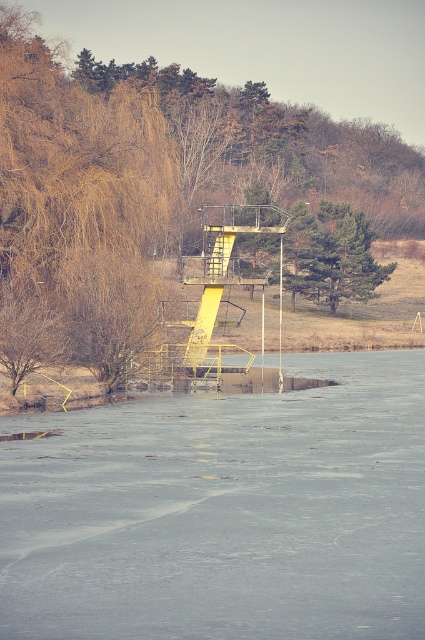
Which of these two, brown leafy tree at upper left or green textured tree at center, stands shorter?

green textured tree at center

Who is positioned more to the left, brown leafy tree at upper left or green textured tree at center?

brown leafy tree at upper left

Describe the element at coordinates (169, 152) in the screenshot. I see `brown leafy tree at upper left` at that location.

The image size is (425, 640). Find the location of `brown leafy tree at upper left`. brown leafy tree at upper left is located at coordinates (169, 152).

Which is in front, point (22, 488) or point (291, 230)?

Point (22, 488) is more forward.

Between transparent ice at center and green textured tree at center, which one appears on the left side from the viewer's perspective?

Positioned to the left is transparent ice at center.

Is point (59, 502) more distant than point (365, 257)?

No, (59, 502) is closer to viewer.

Find the location of a particular element. The image size is (425, 640). transparent ice at center is located at coordinates (223, 512).

Consider the image. Does transparent ice at center appear on the left side of brown leafy tree at upper left?

In fact, transparent ice at center is to the right of brown leafy tree at upper left.

Is transparent ice at center bigger than brown leafy tree at upper left?

Incorrect, transparent ice at center is not larger than brown leafy tree at upper left.

Does point (42, 618) lie in front of point (186, 81)?

Yes, it is.

Where is `transparent ice at center`? transparent ice at center is located at coordinates (223, 512).